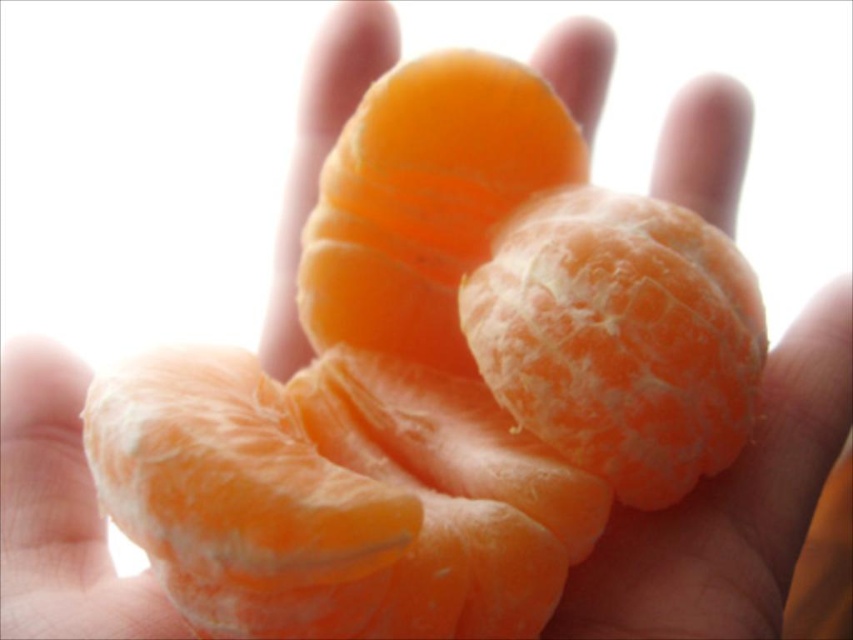
Does orange matte tangerine at center have a greater width compared to orangesmoothorange segment at center?

No.

The height and width of the screenshot is (640, 853). Describe the element at coordinates (619, 337) in the screenshot. I see `orange matte tangerine at center` at that location.

Locate an element on the screen. This screenshot has width=853, height=640. orange matte tangerine at center is located at coordinates (619, 337).